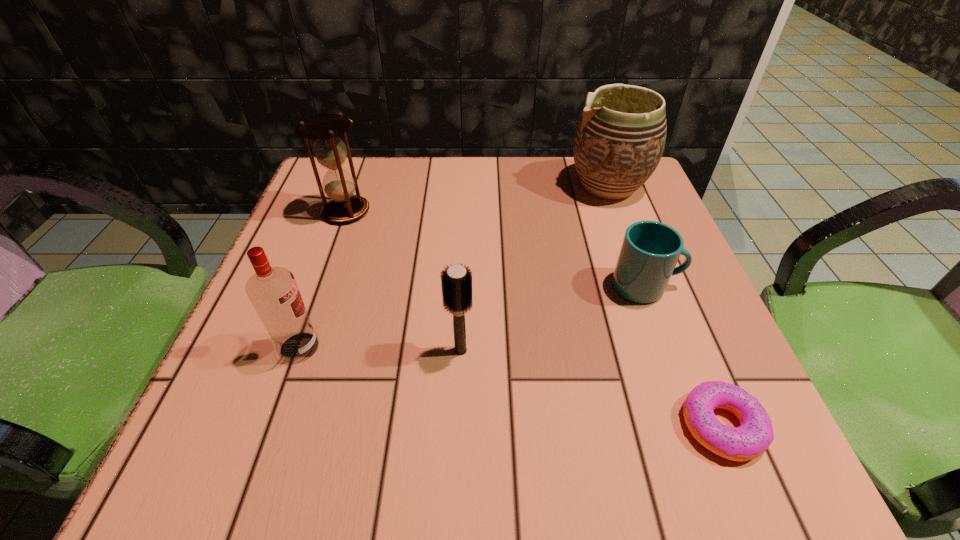
Where is `free space between the fourth object from right to left and the pottery`? Image resolution: width=960 pixels, height=540 pixels. free space between the fourth object from right to left and the pottery is located at coordinates (535, 268).

Locate an element on the screen. Image resolution: width=960 pixels, height=540 pixels. vacant space that is in between the hourglass and the second shortest object is located at coordinates (496, 249).

The image size is (960, 540). What are the coordinates of `free space between the pottery and the hairbrush` in the screenshot? It's located at (535, 268).

In order to click on free space between the vodka and the hourglass in this screenshot , I will do `click(323, 279)`.

This screenshot has height=540, width=960. Identify the location of free space between the pottery and the third shortest object. 535,268.

Locate an element on the screen. This screenshot has width=960, height=540. vacant point located between the fourth object from right to left and the doughnut is located at coordinates (591, 388).

You are a GUI agent. You are given a task and a screenshot of the screen. Output one action in this format:
    pyautogui.click(x=<x>, y=<y>)
    Task: Click on the object that stands as the fifth closest to the shortest object
    
    Given the screenshot: What is the action you would take?
    pyautogui.click(x=330, y=151)

Image resolution: width=960 pixels, height=540 pixels. I want to click on object that is the third closest to the vodka, so click(x=650, y=250).

In order to click on vacant area in the image that satisfies the following two spatial constraints: 1. on the front side of the pottery; 2. on the front label of the vodka in this screenshot , I will do `click(667, 347)`.

Image resolution: width=960 pixels, height=540 pixels. I want to click on vacant space that satisfies the following two spatial constraints: 1. on the front side of the pottery; 2. on the right side of the doughnut, so click(x=696, y=426).